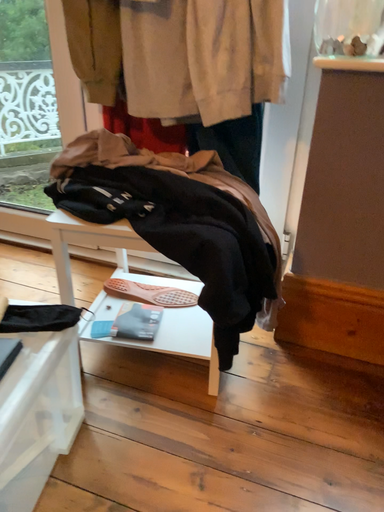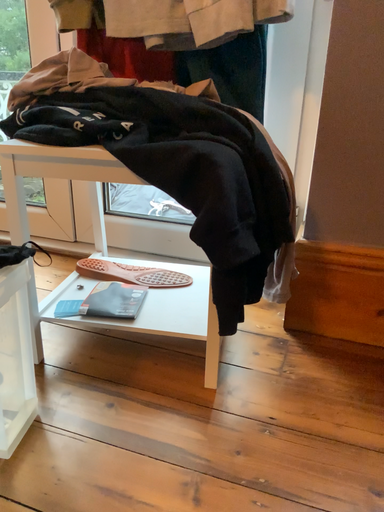
Question: Which way did the camera rotate in the video?

Choices:
 (A) rotated downward
 (B) rotated upward

Answer: (B)